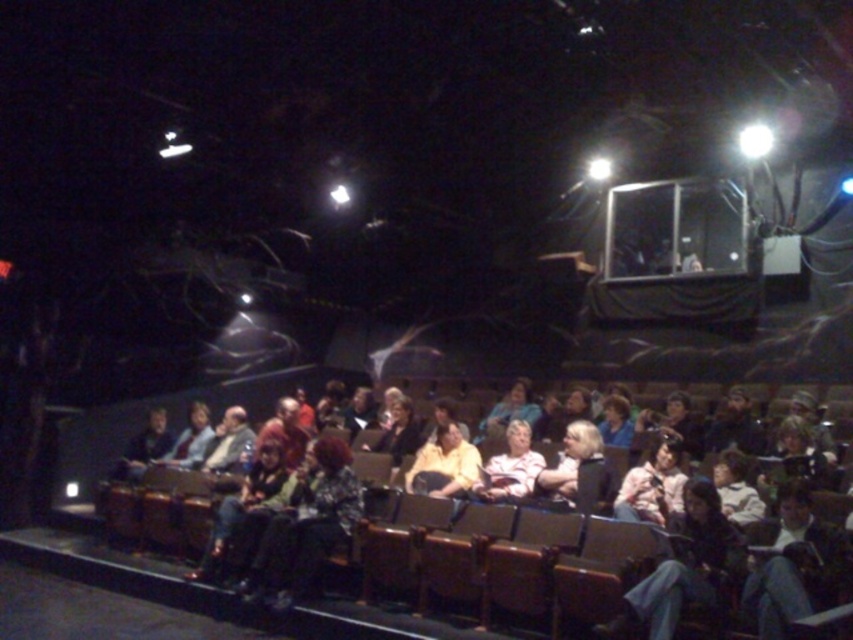
Between camouflage-patterned jacket at center and striped fabric shirt at center, which one appears on the left side from the viewer's perspective?

camouflage-patterned jacket at center is more to the left.

Is point (273, 602) positioned behind point (520, 458)?

No, it is not.

Find the location of `camouflage-patterned jacket at center`. camouflage-patterned jacket at center is located at coordinates (306, 522).

Is the position of camouflage-patterned jacket at center less distant than that of light blue fabric jacket at center?

That is True.

This screenshot has height=640, width=853. I want to click on camouflage-patterned jacket at center, so click(306, 522).

Who is shorter, striped fabric shirt at center or light blue fabric jacket at center?

striped fabric shirt at center

Measure the distance between striped fabric shirt at center and light blue fabric jacket at center.

striped fabric shirt at center is 1.54 meters from light blue fabric jacket at center.

Find the location of a particular element. striped fabric shirt at center is located at coordinates (509, 467).

You are a GUI agent. You are given a task and a screenshot of the screen. Output one action in this format:
    pyautogui.click(x=<x>, y=<y>)
    Task: Click on the striped fabric shirt at center
    
    Given the screenshot: What is the action you would take?
    pyautogui.click(x=509, y=467)